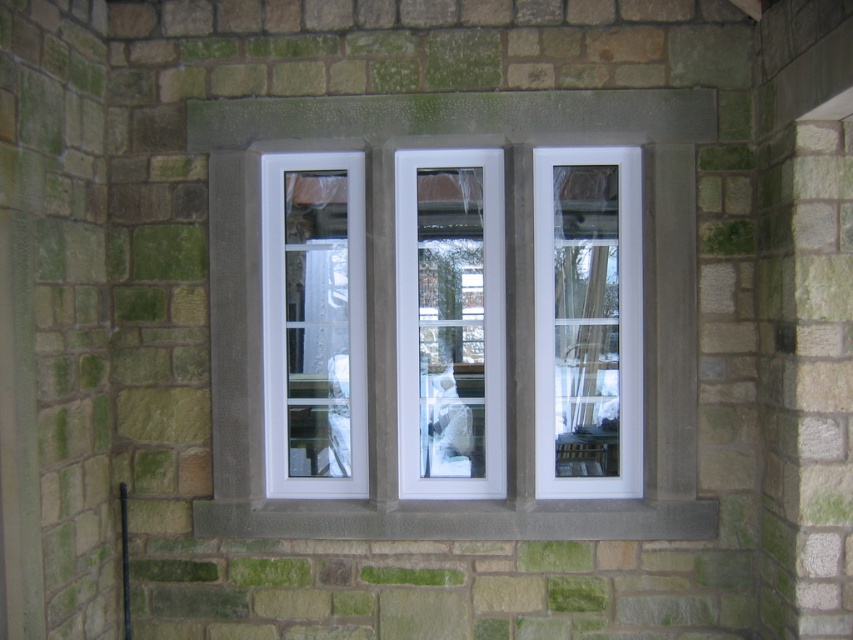
Question: Is white glossy glass door at center thinner than gray stone window sill at center?

Choices:
 (A) yes
 (B) no

Answer: (A)

Question: Is white plastic windows at center positioned at the back of white glass door at center?

Choices:
 (A) no
 (B) yes

Answer: (A)

Question: Which point is closer to the camera?

Choices:
 (A) (415, 484)
 (B) (695, 440)
 (C) (596, 512)
 (D) (550, 305)

Answer: (B)

Question: Can you confirm if white glass door at center is wider than white glossy glass door at center?

Choices:
 (A) yes
 (B) no

Answer: (A)

Question: Which of the following is the farthest from the observer?

Choices:
 (A) (515, 532)
 (B) (425, 403)
 (C) (514, 362)
 (D) (541, 397)

Answer: (B)

Question: Based on their relative distances, which object is farther from the white glass door at center?

Choices:
 (A) white plastic windows at center
 (B) gray stone window sill at center

Answer: (B)